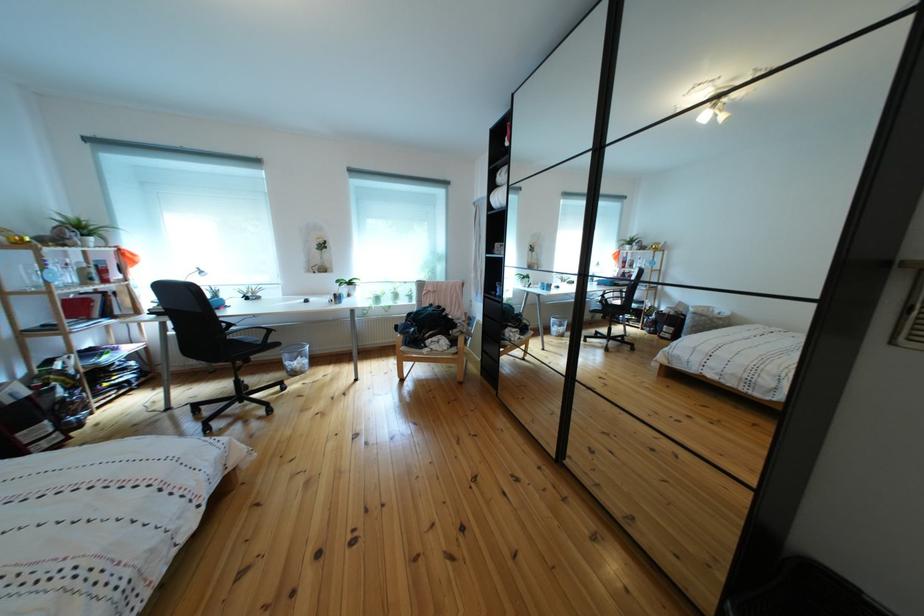
Where would you grasp the black chair armrest? Please return your answer as a coordinate pair (x, y).

(252, 337)